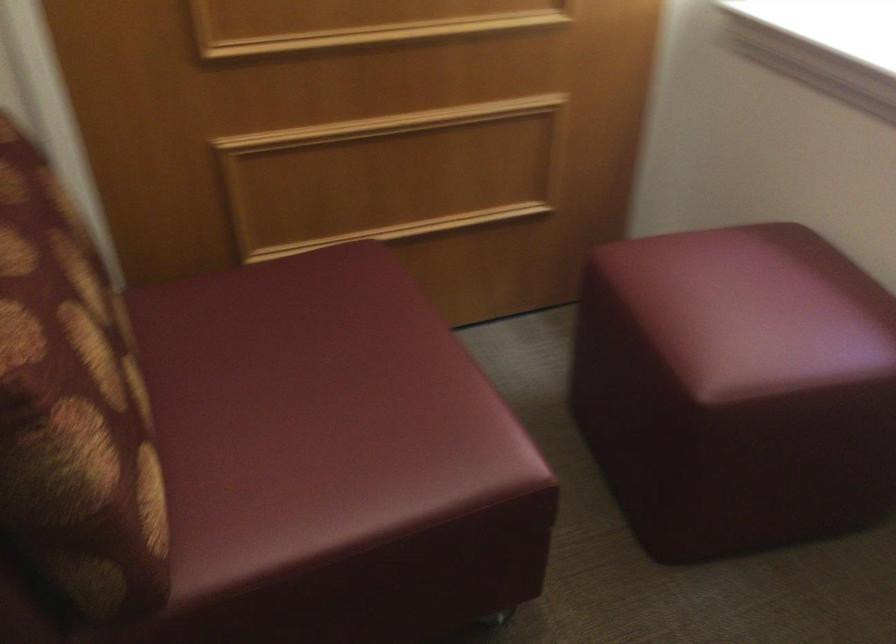
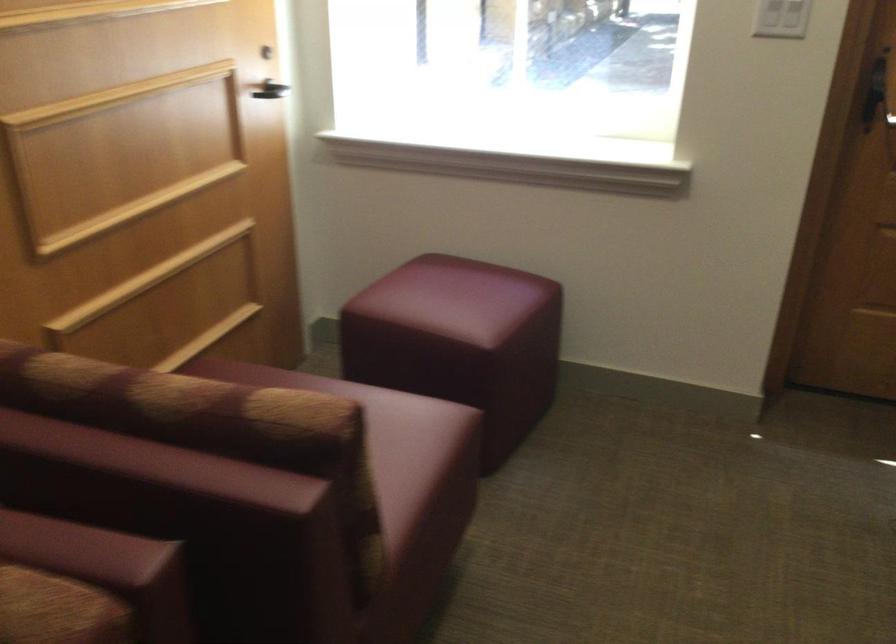
Question: I am providing you with two images of the same scene from different viewpoints. Please identify which objects are invisible in image2.

Choices:
 (A) light colored hairbrush
 (B) burgundy ottoman
 (C) red ottoman sitting surface
 (D) sofa sitting surface

Answer: (C)